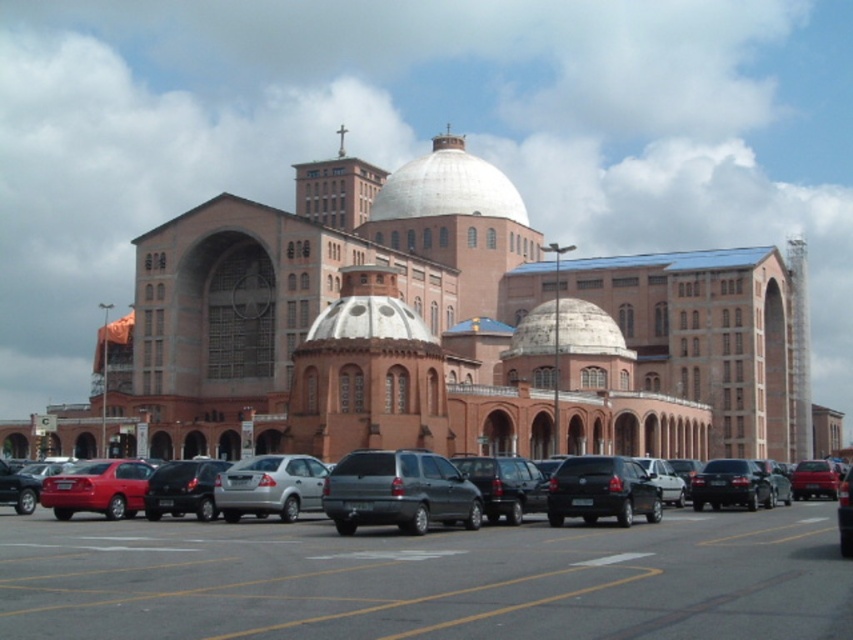
Does white matte dome at center have a larger size compared to satin black suv at center?

Yes.

Is point (447, 141) positioned after point (555, 502)?

Yes, point (447, 141) is farther from viewer.

Is point (430, 195) positioned behind point (646, 497)?

Yes, point (430, 195) is behind point (646, 497).

At what (x,y) coordinates should I click in order to perform the action: click on white matte dome at center. Please return your answer as a coordinate pair (x, y). Looking at the image, I should click on (447, 186).

This screenshot has height=640, width=853. Find the location of `satin black suv at center`. satin black suv at center is located at coordinates (601, 490).

Measure the distance from satin black suv at center to silver metallic sedan at center.

13.15 meters

Is point (587, 499) positioned behind point (279, 496)?

No, it is in front of (279, 496).

You are a GUI agent. You are given a task and a screenshot of the screen. Output one action in this format:
    pyautogui.click(x=<x>, y=<y>)
    Task: Click on the satin black suv at center
    
    Given the screenshot: What is the action you would take?
    pyautogui.click(x=601, y=490)

Is point (190, 634) closer to viewer compared to point (611, 458)?

Yes, point (190, 634) is in front of point (611, 458).

The width and height of the screenshot is (853, 640). I want to click on matte black car at center, so click(x=421, y=541).

Who is more distant from viewer, (436, 570) or (628, 493)?

The point (628, 493) is behind.

Where is `matte black car at center`? matte black car at center is located at coordinates (421, 541).